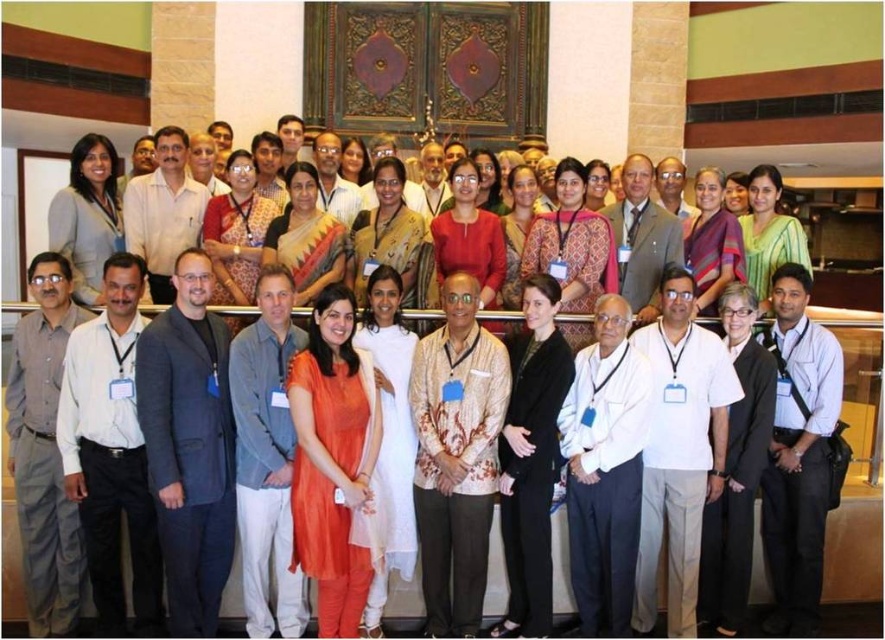
You are organizing a photo shoot and need to ensure that all participants are visible in the frame. Considering the white shirt at center and the matte purple sari at center, which one takes up more space in the image?

The matte purple sari at center occupies more space than the white shirt at center, so it will be more visible in the frame.

You are standing at the center of the room and see two points marked on the floor. The first point is labeled as point 1 at coordinates point (724, 243) and the second point is labeled as point 2 at coordinates point (749, 243). Which point is closer to you?

Point 1 at coordinates point (724, 243) is closer to you because it is in front of point 2 at coordinates point (749, 243).